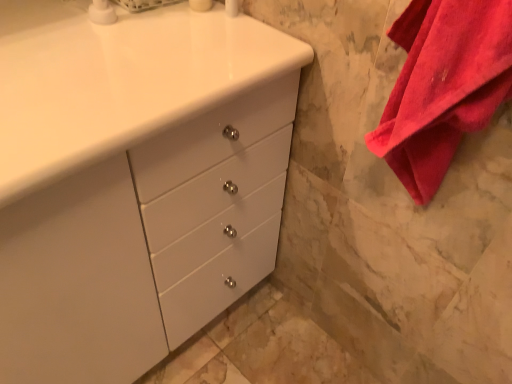
Where is `vacant point to the right of white glossy soap dispenser at upper left`? vacant point to the right of white glossy soap dispenser at upper left is located at coordinates (179, 30).